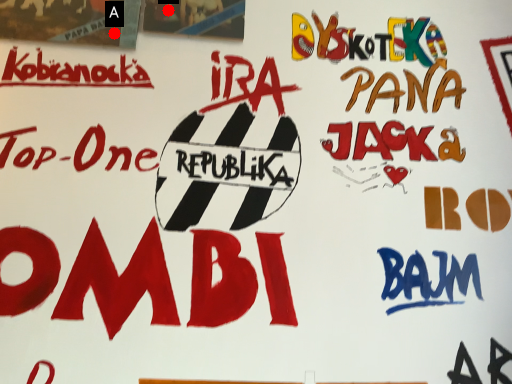
Question: Two points are circled on the image, labeled by A and B beside each circle. Which point is further to the camera?

Choices:
 (A) A is further
 (B) B is further

Answer: (B)